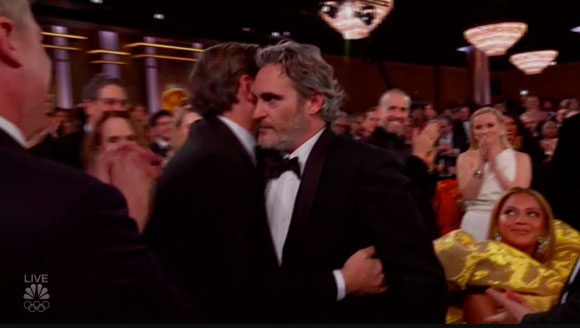
Image resolution: width=580 pixels, height=328 pixels. In order to click on lights hanging from ceiling in this screenshot , I will do `click(501, 37)`, `click(539, 63)`, `click(351, 22)`.